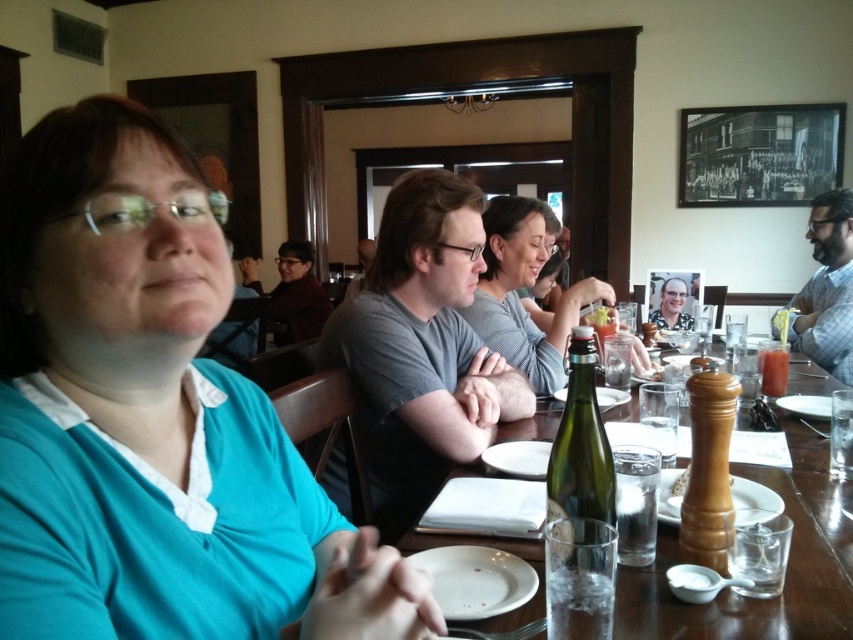
You are sitting at the dining table in the restaurant and want to reach for an item located at point (538, 422). Is this point closer to you or farther away compared to point (697, 445)?

Point (538, 422) is behind point (697, 445), so it is farther away from you compared to point (697, 445).

You are a server at the restaurant and need to place a new menu on the table. The menu is the same size as the wooden pepper mill at center. Where on the wooden table at center can you place the menu so it fits without overlapping anything?

Since the wooden table at center is larger than the wooden pepper mill at center, you can place the menu in an empty space on the wooden table at center where there are no existing items, ensuring it doesn not overlap with the pepper mill or other objects.

You are a customer at a restaurant and want to place your phone on the wooden table at center. If the table has coordinates with the bottom left corner at point 0,0 and the top right corner at point 1,1, where would you place your phone?

The wooden table at center is located at point (786, 570), so placing the phone near that coordinate would be appropriate.